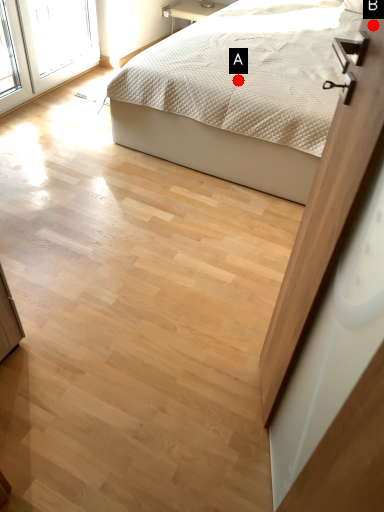
Question: Two points are circled on the image, labeled by A and B beside each circle. Which point is closer to the camera taking this photo?

Choices:
 (A) A is closer
 (B) B is closer

Answer: (B)